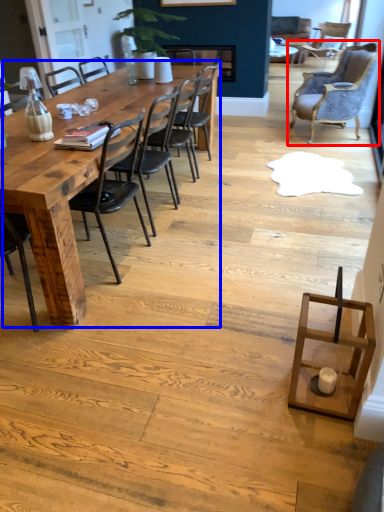
Question: Which of the following is the farthest to the observer, chair (highlighted by a red box) or kitchen & dining room table (highlighted by a blue box)?

Choices:
 (A) chair
 (B) kitchen & dining room table

Answer: (A)